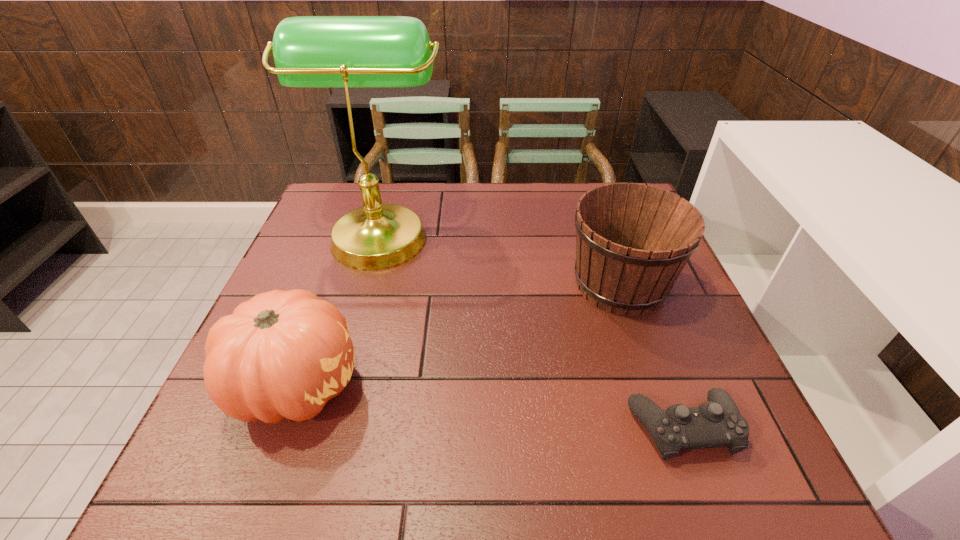
Where is `free space between the lamp and the pumpkin`? The width and height of the screenshot is (960, 540). free space between the lamp and the pumpkin is located at coordinates (339, 308).

Where is `the third closest object to the wine bucket`? The image size is (960, 540). the third closest object to the wine bucket is located at coordinates (282, 354).

Find the location of `object that stands as the closest to the shortest object`. object that stands as the closest to the shortest object is located at coordinates (632, 241).

Where is `vacant region that satisfies the following two spatial constraints: 1. on the desk next to the tallest object; 2. on the right side of the wine bucket`? The height and width of the screenshot is (540, 960). vacant region that satisfies the following two spatial constraints: 1. on the desk next to the tallest object; 2. on the right side of the wine bucket is located at coordinates (367, 284).

You are a GUI agent. You are given a task and a screenshot of the screen. Output one action in this format:
    pyautogui.click(x=<x>, y=<y>)
    Task: Click on the vacant point that satisfies the following two spatial constraints: 1. on the desk next to the tallest object; 2. on the back side of the shortest object
    This screenshot has height=540, width=960.
    Given the screenshot: What is the action you would take?
    pyautogui.click(x=326, y=427)

I want to click on free space that satisfies the following two spatial constraints: 1. on the back side of the shortest object; 2. on the desk next to the tallest object, so click(612, 232).

Locate an element on the screen. Image resolution: width=960 pixels, height=540 pixels. free spot that satisfies the following two spatial constraints: 1. on the carved face of the pumpkin; 2. on the right side of the control is located at coordinates (281, 427).

I want to click on vacant region that satisfies the following two spatial constraints: 1. on the desk next to the tallest object; 2. on the right side of the wine bucket, so click(x=367, y=284).

The width and height of the screenshot is (960, 540). Find the location of `free space that satisfies the following two spatial constraints: 1. on the carved face of the shortest object; 2. on the left side of the pumpkin`. free space that satisfies the following two spatial constraints: 1. on the carved face of the shortest object; 2. on the left side of the pumpkin is located at coordinates pyautogui.click(x=281, y=427).

What are the coordinates of `free location that satisfies the following two spatial constraints: 1. on the carved face of the pumpkin; 2. on the back side of the control` in the screenshot? It's located at (281, 427).